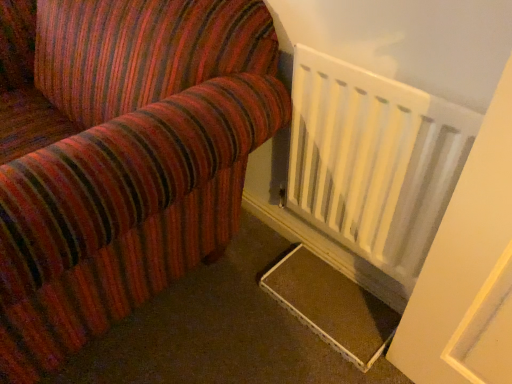
Question: Is brown textured mat at lower right wider or thinner than white matte radiator at lower right?

Choices:
 (A) thin
 (B) wide

Answer: (B)

Question: Considering the positions of brown textured mat at lower right and white matte radiator at lower right in the image, is brown textured mat at lower right bigger or smaller than white matte radiator at lower right?

Choices:
 (A) small
 (B) big

Answer: (A)

Question: From a real-world perspective, is brown textured mat at lower right above or below white matte radiator at lower right?

Choices:
 (A) above
 (B) below

Answer: (B)

Question: Is white matte radiator at lower right taller or shorter than brown textured mat at lower right?

Choices:
 (A) short
 (B) tall

Answer: (B)

Question: Considering the positions of white matte radiator at lower right and brown textured mat at lower right in the image, is white matte radiator at lower right bigger or smaller than brown textured mat at lower right?

Choices:
 (A) big
 (B) small

Answer: (A)

Question: Considering the positions of point pyautogui.click(x=387, y=125) and point pyautogui.click(x=356, y=319), is point pyautogui.click(x=387, y=125) closer or farther from the camera than point pyautogui.click(x=356, y=319)?

Choices:
 (A) closer
 (B) farther

Answer: (A)

Question: Is white matte radiator at lower right wider or thinner than brown textured mat at lower right?

Choices:
 (A) thin
 (B) wide

Answer: (A)